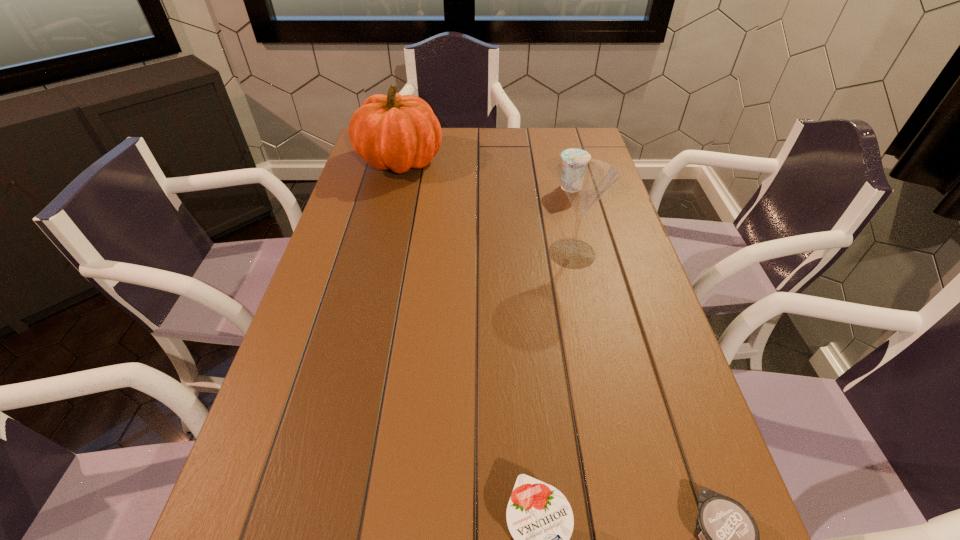
Locate an element on the screen. This screenshot has height=540, width=960. pumpkin is located at coordinates (398, 132).

In order to click on the third farthest object in this screenshot , I will do `click(585, 180)`.

Identify the location of the farthest yogurt. (573, 152).

Where is `free space located on the right of the pumpkin`? This screenshot has height=540, width=960. free space located on the right of the pumpkin is located at coordinates (513, 160).

This screenshot has width=960, height=540. Find the location of `free location located on the back of the third farthest object`. free location located on the back of the third farthest object is located at coordinates (553, 168).

Locate an element on the screen. This screenshot has width=960, height=540. free spot located on the back of the second yogurt from right to left is located at coordinates (561, 148).

Where is `object situated at the far edge`? object situated at the far edge is located at coordinates (398, 132).

Where is `object located in the left edge section of the desktop`? This screenshot has width=960, height=540. object located in the left edge section of the desktop is located at coordinates (398, 132).

The image size is (960, 540). In order to click on flute glass located at the right edge in this screenshot , I will do `click(585, 180)`.

The image size is (960, 540). I want to click on yogurt that is at the right edge, so click(x=573, y=152).